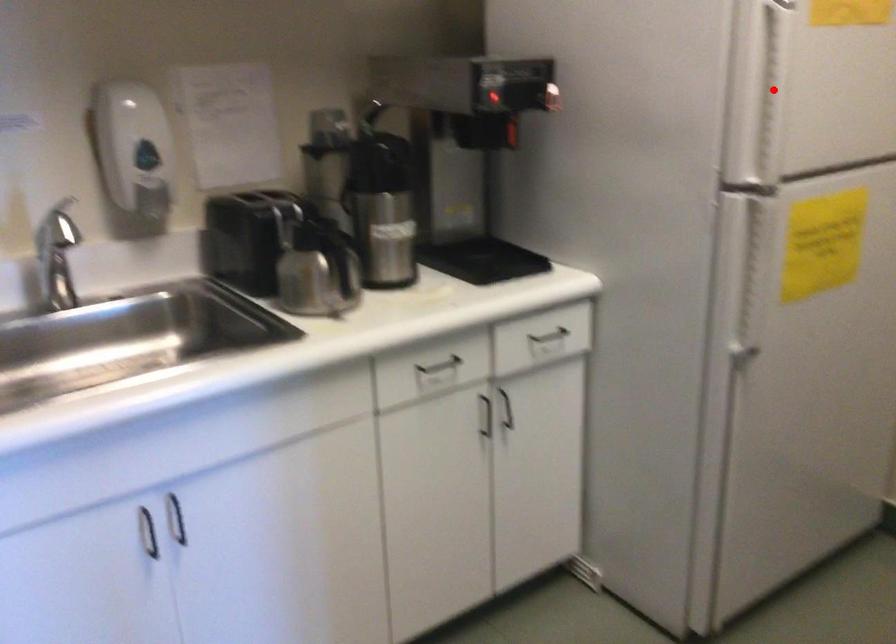
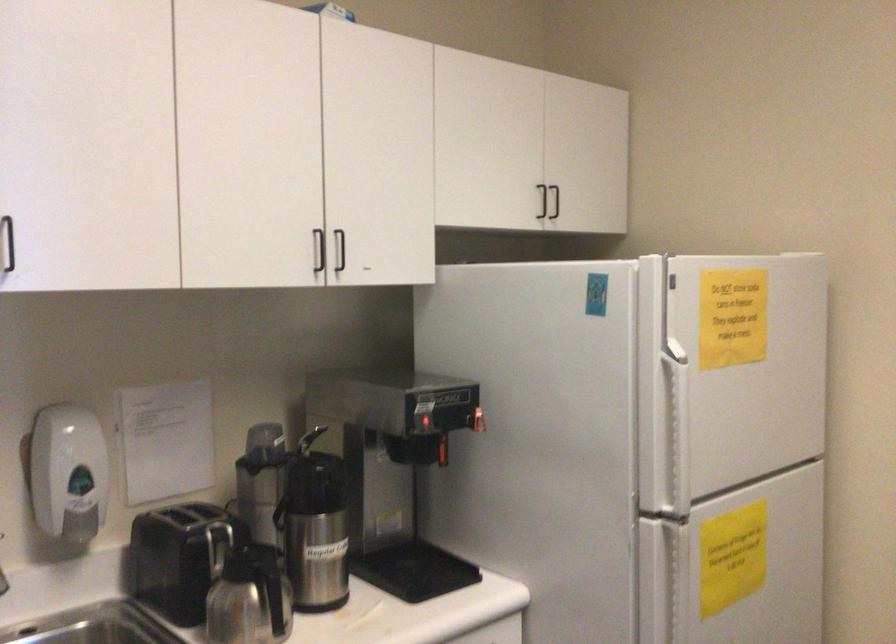
Question: I am providing you with two images of the same scene from different viewpoints. A red point is shown in image1. For the corresponding object point in image2, is it positioned nearer or farther from the camera?

Choices:
 (A) Nearer
 (B) Farther

Answer: (B)